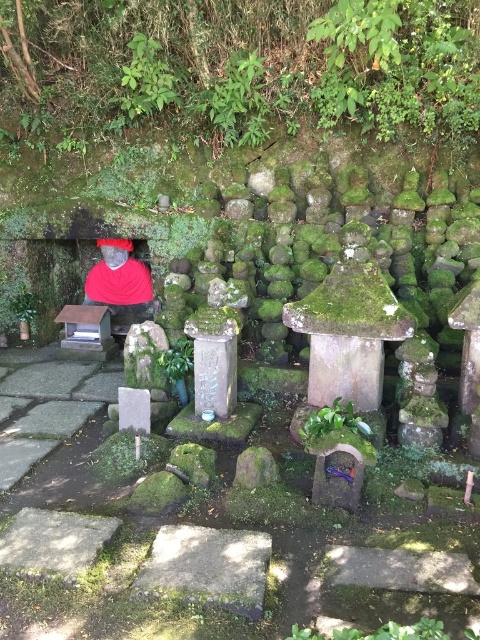
Does green mossy rocks at upper center have a greater width compared to green leafy plant at center?

Yes.

Does point (424, 1) come in front of point (338, 408)?

No, (424, 1) is behind (338, 408).

I want to click on green mossy rocks at upper center, so click(238, 68).

Who is positioned more to the right, green mossy rocks at upper center or matte red shirt at left?

green mossy rocks at upper center

Is point (348, 38) closer to viewer compared to point (134, 298)?

Yes, point (348, 38) is in front of point (134, 298).

Is point (47, 77) behind point (111, 305)?

That is True.

Identify the location of green mossy rocks at upper center. (238, 68).

Who is shorter, matte red shirt at left or green leafy plant at center?

Standing shorter between the two is green leafy plant at center.

Which is in front, point (115, 246) or point (336, 417)?

Point (336, 417)

Which is behind, point (109, 289) or point (360, 420)?

The point (109, 289) is behind.

This screenshot has width=480, height=640. Find the location of `matte red shirt at left`. matte red shirt at left is located at coordinates (120, 282).